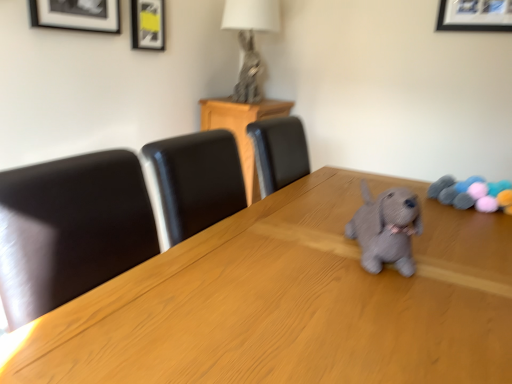
Question: Looking at the image, does gray knitted dog at center seem bigger or smaller compared to matte black picture frame at upper left, which is the first picture frame in front-to-back order?

Choices:
 (A) small
 (B) big

Answer: (B)

Question: From a real-world perspective, is gray knitted dog at center physically located above or below matte black picture frame at upper left, which ranks as the first picture frame in left-to-right order?

Choices:
 (A) above
 (B) below

Answer: (B)

Question: Estimate the real-world distances between objects in this image. Which object is farther from the metallic silver rabbit at upper center?

Choices:
 (A) black leather chair at center
 (B) gray knitted dog at center
 (C) matte black picture frame at upper left, which is the first picture frame in front-to-back order
 (D) matte black picture frame at upper left, acting as the 1th picture frame starting from the back
 (E) wooden table at center

Answer: (B)

Question: Which object is positioned closest to the wooden table at center?

Choices:
 (A) gray knitted dog at center
 (B) matte black picture frame at upper left, which ranks as the first picture frame in left-to-right order
 (C) gray knitted stuffed animal at right
 (D) metallic silver rabbit at upper center
 (E) matte black picture frame at upper left, acting as the second picture frame starting from the front

Answer: (A)